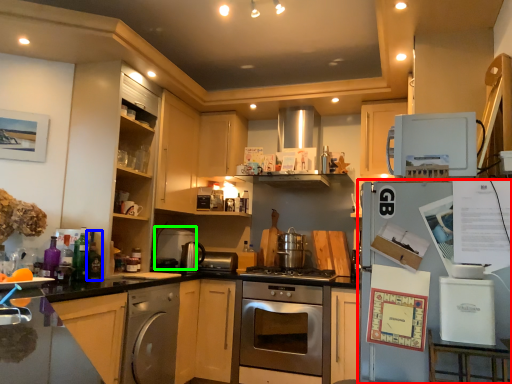
Question: Considering the real-world distances, which object is closest to refrigerator (highlighted by a red box)? bottle (highlighted by a blue box) or appliance (highlighted by a green box).

Choices:
 (A) bottle
 (B) appliance

Answer: (A)